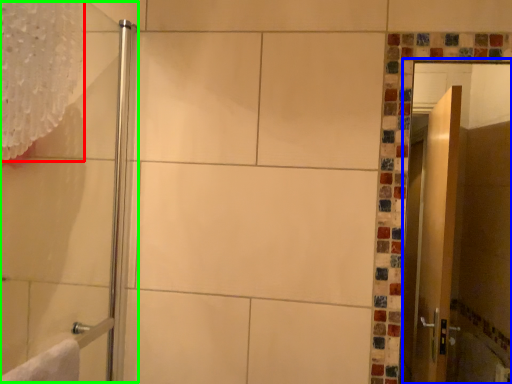
Question: Which is nearer to the shower curtain (highlighted by a red box)? screen door (highlighted by a blue box) or shower door (highlighted by a green box).

Choices:
 (A) screen door
 (B) shower door

Answer: (B)